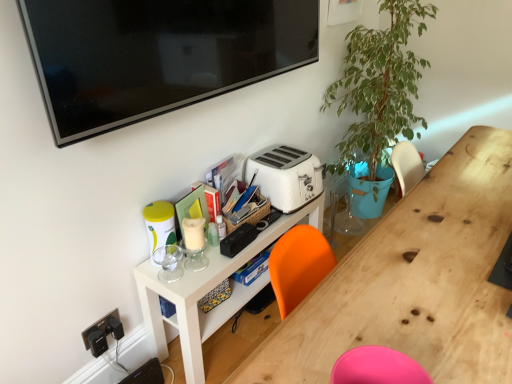
Question: Can you confirm if white plastic toaster at center is thinner than white matte shelf at center?

Choices:
 (A) yes
 (B) no

Answer: (B)

Question: Is white plastic toaster at center far from white matte shelf at center?

Choices:
 (A) yes
 (B) no

Answer: (B)

Question: Is white plastic toaster at center positioned behind white matte shelf at center?

Choices:
 (A) yes
 (B) no

Answer: (A)

Question: Considering the relative positions of white plastic toaster at center and white matte shelf at center in the image provided, is white plastic toaster at center to the left of white matte shelf at center from the viewer's perspective?

Choices:
 (A) yes
 (B) no

Answer: (B)

Question: From a real-world perspective, is white plastic toaster at center physically above white matte shelf at center?

Choices:
 (A) no
 (B) yes

Answer: (B)

Question: Considering the positions of point (408, 11) and point (450, 284), is point (408, 11) closer or farther from the camera than point (450, 284)?

Choices:
 (A) farther
 (B) closer

Answer: (A)

Question: In terms of width, does green leafy plant at upper right look wider or thinner when compared to wooden desk at center?

Choices:
 (A) thin
 (B) wide

Answer: (B)

Question: Considering the positions of green leafy plant at upper right and wooden desk at center in the image, is green leafy plant at upper right taller or shorter than wooden desk at center?

Choices:
 (A) short
 (B) tall

Answer: (B)

Question: Considering the relative positions of green leafy plant at upper right and wooden desk at center in the image provided, is green leafy plant at upper right to the left or to the right of wooden desk at center?

Choices:
 (A) left
 (B) right

Answer: (B)

Question: Considering the positions of white matte shelf at center and white plastic toaster at center in the image, is white matte shelf at center bigger or smaller than white plastic toaster at center?

Choices:
 (A) small
 (B) big

Answer: (B)

Question: Is point (174, 322) positioned closer to the camera than point (261, 190)?

Choices:
 (A) farther
 (B) closer

Answer: (B)

Question: From the image's perspective, relative to white plastic toaster at center, is white matte shelf at center above or below?

Choices:
 (A) below
 (B) above

Answer: (A)

Question: Considering the positions of white matte shelf at center and white plastic toaster at center in the image, is white matte shelf at center taller or shorter than white plastic toaster at center?

Choices:
 (A) tall
 (B) short

Answer: (A)

Question: Based on their sizes in the image, would you say green leafy plant at upper right is bigger or smaller than white matte shelf at center?

Choices:
 (A) small
 (B) big

Answer: (B)

Question: From a real-world perspective, is green leafy plant at upper right physically located above or below white matte shelf at center?

Choices:
 (A) above
 (B) below

Answer: (A)